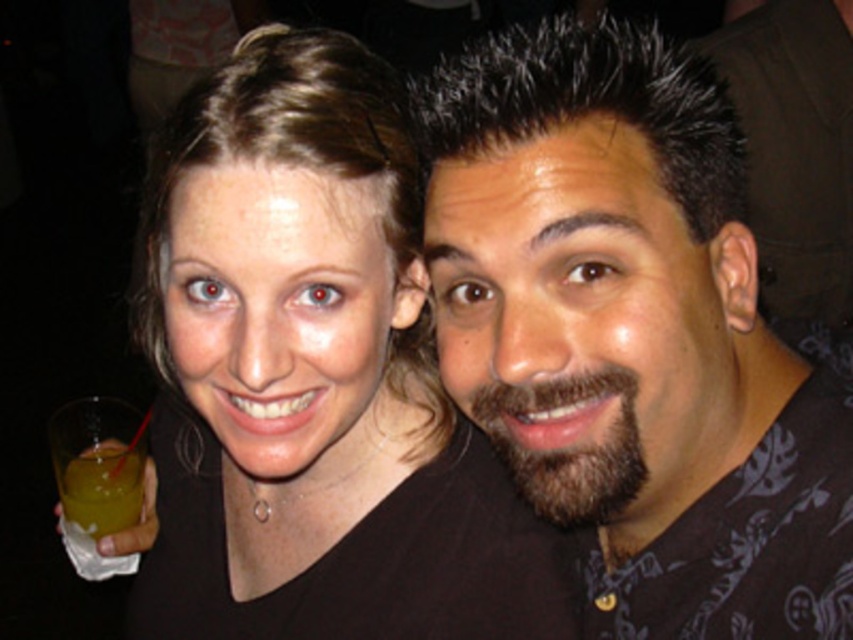
Measure the distance between matte black shirt at center and camera.

54.82 centimeters

You are a GUI agent. You are given a task and a screenshot of the screen. Output one action in this format:
    pyautogui.click(x=<x>, y=<y>)
    Task: Click on the matte black shirt at center
    This screenshot has width=853, height=640.
    Given the screenshot: What is the action you would take?
    click(x=314, y=378)

Which is more to the left, dark brown hair at center or translucent yellow liquid at lower left?

Positioned to the left is translucent yellow liquid at lower left.

In order to click on dark brown hair at center in this screenshot , I will do `click(631, 333)`.

Who is higher up, dark brown hair at center or matte black shirt at center?

dark brown hair at center is above.

Is dark brown hair at center shorter than matte black shirt at center?

Correct, dark brown hair at center is not as tall as matte black shirt at center.

Which is behind, point (549, 243) or point (225, 310)?

Point (225, 310)

You are a GUI agent. You are given a task and a screenshot of the screen. Output one action in this format:
    pyautogui.click(x=<x>, y=<y>)
    Task: Click on the dark brown hair at center
    The height and width of the screenshot is (640, 853).
    Given the screenshot: What is the action you would take?
    pyautogui.click(x=631, y=333)